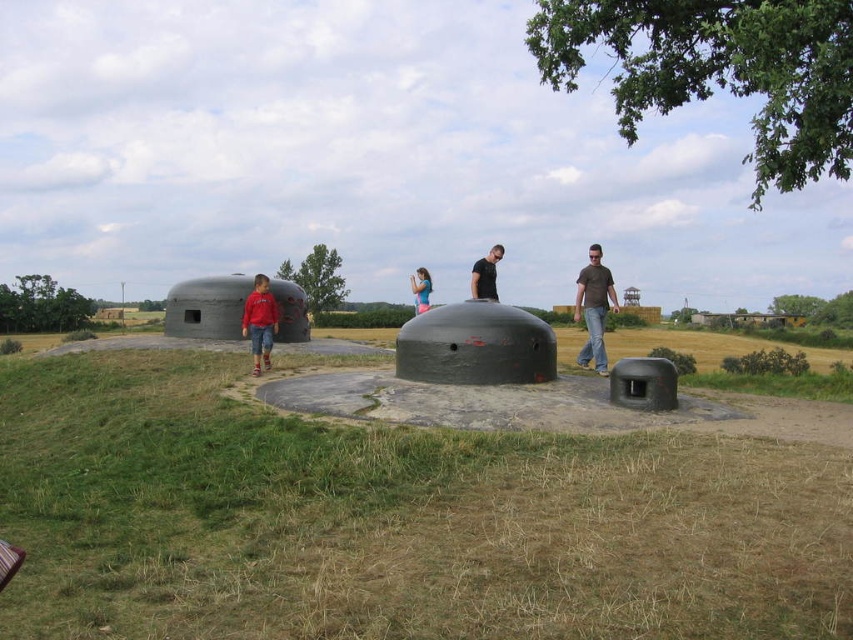
Who is higher up, matte green bunker at center or matte red shirt at left?

matte red shirt at left is higher up.

Is the position of matte green bunker at center less distant than that of matte red shirt at left?

Yes, it is.

You are a GUI agent. You are given a task and a screenshot of the screen. Output one action in this format:
    pyautogui.click(x=<x>, y=<y>)
    Task: Click on the matte green bunker at center
    This screenshot has height=640, width=853.
    Given the screenshot: What is the action you would take?
    pyautogui.click(x=474, y=346)

How distant is brown cotton shirt at center from blue denim jeans at center?

The distance of brown cotton shirt at center from blue denim jeans at center is 13.34 feet.

Which is in front, point (595, 288) or point (425, 272)?

Positioned in front is point (595, 288).

At what (x,y) coordinates should I click in order to perform the action: click on brown cotton shirt at center. Please return your answer as a coordinate pair (x, y). The width and height of the screenshot is (853, 640). Looking at the image, I should click on (595, 308).

From the picture: Is brown cotton shirt at center to the right of matte red shirt at left from the viewer's perspective?

Correct, you'll find brown cotton shirt at center to the right of matte red shirt at left.

Is brown cotton shirt at center to the left of matte red shirt at left from the viewer's perspective?

In fact, brown cotton shirt at center is to the right of matte red shirt at left.

Is point (596, 314) farther from viewer compared to point (276, 304)?

No.

The width and height of the screenshot is (853, 640). Find the location of `brown cotton shirt at center`. brown cotton shirt at center is located at coordinates (595, 308).